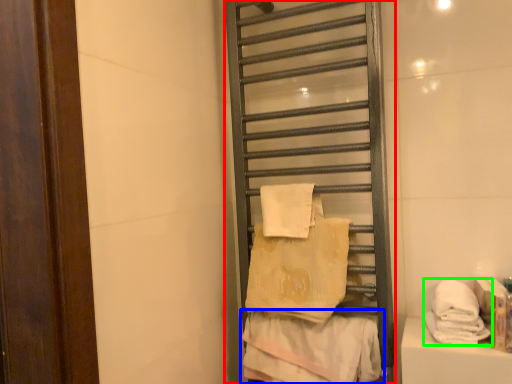
Question: Estimate the real-world distances between objects in this image. Which object is closer to shelf (highlighted by a red box), towel (highlighted by a blue box) or towel (highlighted by a green box)?

Choices:
 (A) towel
 (B) towel

Answer: (A)